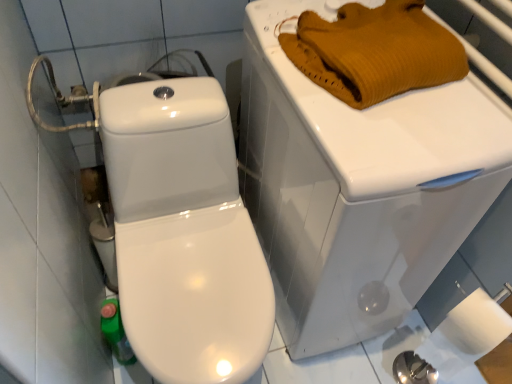
In order to face white glossy porcelain at upper right, should I rotate leftwards or rightwards?

To align with it, rotate right about 9.383°.

This screenshot has height=384, width=512. I want to click on white glossy porcelain at upper right, so click(x=359, y=187).

What do you see at coordinates (359, 187) in the screenshot? I see `white glossy porcelain at upper right` at bounding box center [359, 187].

Looking at this image, measure the distance between white glossy porcelain at upper right and camera.

The distance of white glossy porcelain at upper right from camera is 72.85 centimeters.

Describe the element at coordinates (375, 51) in the screenshot. I see `knitted wool sweater at upper right` at that location.

This screenshot has width=512, height=384. I want to click on knitted wool sweater at upper right, so click(375, 51).

Where is `white glossy porcelain at upper right`? The image size is (512, 384). white glossy porcelain at upper right is located at coordinates (359, 187).

Considering the positions of objects knitted wool sweater at upper right and white glossy porcelain at upper right in the image provided, who is more to the right, knitted wool sweater at upper right or white glossy porcelain at upper right?

knitted wool sweater at upper right is more to the right.

Considering the positions of objects knitted wool sweater at upper right and white glossy porcelain at upper right in the image provided, who is behind, knitted wool sweater at upper right or white glossy porcelain at upper right?

Positioned behind is knitted wool sweater at upper right.

Considering the positions of point (317, 78) and point (486, 104), is point (317, 78) closer or farther from the camera than point (486, 104)?

Clearly, point (317, 78) is more distant from the camera than point (486, 104).

In the scene shown: From the image's perspective, between knitted wool sweater at upper right and white glossy porcelain at upper right, who is located below?

white glossy porcelain at upper right appears lower in the image.

From a real-world perspective, between knitted wool sweater at upper right and white glossy porcelain at upper right, who is vertically lower?

In real-world perspective, white glossy porcelain at upper right is lower.

Is knitted wool sweater at upper right wider or thinner than white glossy porcelain at upper right?

Clearly, knitted wool sweater at upper right has less width compared to white glossy porcelain at upper right.

Does knitted wool sweater at upper right have a lesser height compared to white glossy porcelain at upper right?

Correct, knitted wool sweater at upper right is not as tall as white glossy porcelain at upper right.

Considering the sizes of objects knitted wool sweater at upper right and white glossy porcelain at upper right in the image provided, who is smaller, knitted wool sweater at upper right or white glossy porcelain at upper right?

With smaller size is knitted wool sweater at upper right.

Would you say white glossy porcelain at upper right is part of knitted wool sweater at upper right's contents?

That's incorrect, white glossy porcelain at upper right is not inside knitted wool sweater at upper right.

Is knitted wool sweater at upper right directly adjacent to white glossy porcelain at upper right?

No.

Is knitted wool sweater at upper right turned away from white glossy porcelain at upper right?

Yes.

Can you tell me how much knitted wool sweater at upper right and white glossy porcelain at upper right differ in facing direction?

The facing directions of knitted wool sweater at upper right and white glossy porcelain at upper right are 0.000297 degrees apart.

The height and width of the screenshot is (384, 512). I want to click on material that is above the white glossy porcelain at upper right (from the image's perspective), so click(x=375, y=51).

Which is more to the left, white glossy porcelain at upper right or knitted wool sweater at upper right?

From the viewer's perspective, white glossy porcelain at upper right appears more on the left side.

In the image, is white glossy porcelain at upper right positioned in front of or behind knitted wool sweater at upper right?

In the image, white glossy porcelain at upper right appears in front of knitted wool sweater at upper right.

Is point (251, 136) closer or farther from the camera than point (369, 60)?

Point (251, 136) is farther from the camera than point (369, 60).

From the image's perspective, which is below, white glossy porcelain at upper right or knitted wool sweater at upper right?

white glossy porcelain at upper right.

From a real-world perspective, between white glossy porcelain at upper right and knitted wool sweater at upper right, who is vertically higher?

knitted wool sweater at upper right, from a real-world perspective.

Which of these two, white glossy porcelain at upper right or knitted wool sweater at upper right, is wider?

Wider between the two is white glossy porcelain at upper right.

In terms of height, does white glossy porcelain at upper right look taller or shorter compared to knitted wool sweater at upper right?

white glossy porcelain at upper right is taller than knitted wool sweater at upper right.

Does white glossy porcelain at upper right have a smaller size compared to knitted wool sweater at upper right?

Incorrect, white glossy porcelain at upper right is not smaller in size than knitted wool sweater at upper right.

Is knitted wool sweater at upper right surrounded by white glossy porcelain at upper right?

Yes.

Is white glossy porcelain at upper right not close to knitted wool sweater at upper right?

white glossy porcelain at upper right is near knitted wool sweater at upper right, not far away.

Is white glossy porcelain at upper right facing away from knitted wool sweater at upper right?

No, knitted wool sweater at upper right is not at the back of white glossy porcelain at upper right.

What's the angular difference between white glossy porcelain at upper right and knitted wool sweater at upper right's facing directions?

0.000297 degrees separate the facing orientations of white glossy porcelain at upper right and knitted wool sweater at upper right.

Identify the location of porcelain located on the left of knitted wool sweater at upper right. [359, 187].

Locate an element on the screen. porcelain below the knitted wool sweater at upper right (from the image's perspective) is located at coordinates (359, 187).

This screenshot has height=384, width=512. Find the location of `porcelain in front of the knitted wool sweater at upper right`. porcelain in front of the knitted wool sweater at upper right is located at coordinates (359, 187).